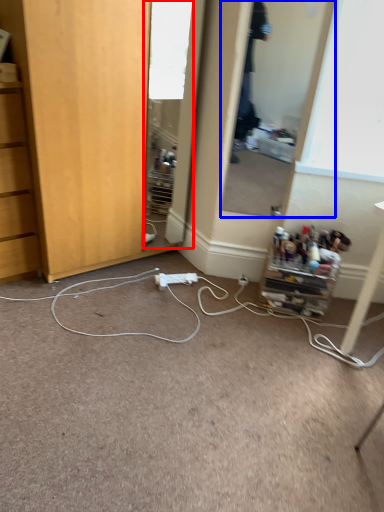
Question: Which of the following is the closest to the observer, mirror (highlighted by a red box) or mirror (highlighted by a blue box)?

Choices:
 (A) mirror
 (B) mirror

Answer: (B)